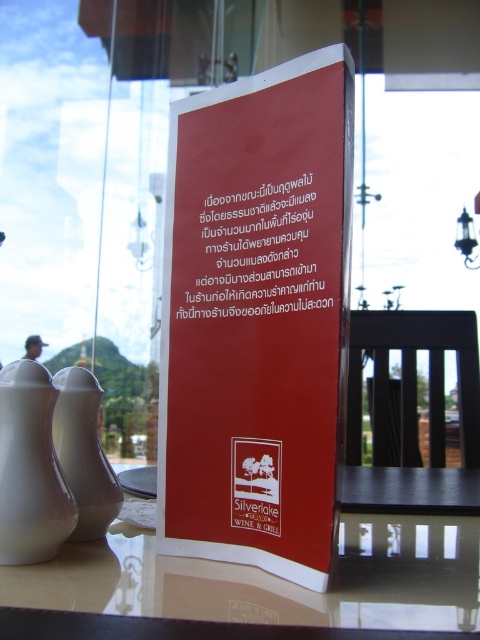
Consider the image. Does glossy glass table at center have a lesser width compared to white ceramic tea pot at lower left?

Incorrect, glossy glass table at center's width is not less than white ceramic tea pot at lower left's.

Does glossy glass table at center have a greater height compared to white ceramic tea pot at lower left?

Incorrect, glossy glass table at center's height is not larger of white ceramic tea pot at lower left's.

At what (x,y) coordinates should I click in order to perform the action: click on glossy glass table at center. Please return your answer as a coordinate pair (x, y). The height and width of the screenshot is (640, 480). Looking at the image, I should click on (273, 576).

What do you see at coordinates (253, 253) in the screenshot? I see `matte red sign at center` at bounding box center [253, 253].

Which is above, matte red sign at center or white ceramic tea pot at lower left?

Positioned higher is matte red sign at center.

Is point (238, 216) positioned behind point (3, 380)?

Yes, it is behind point (3, 380).

This screenshot has width=480, height=640. I want to click on matte red sign at center, so click(253, 253).

Does matte red sign at center appear over white glossy tea pot at lower left?

Correct, matte red sign at center is located above white glossy tea pot at lower left.

Is point (176, 244) farther from camera compared to point (108, 509)?

That is True.

Locate an element on the screen. This screenshot has height=640, width=480. matte red sign at center is located at coordinates (253, 253).